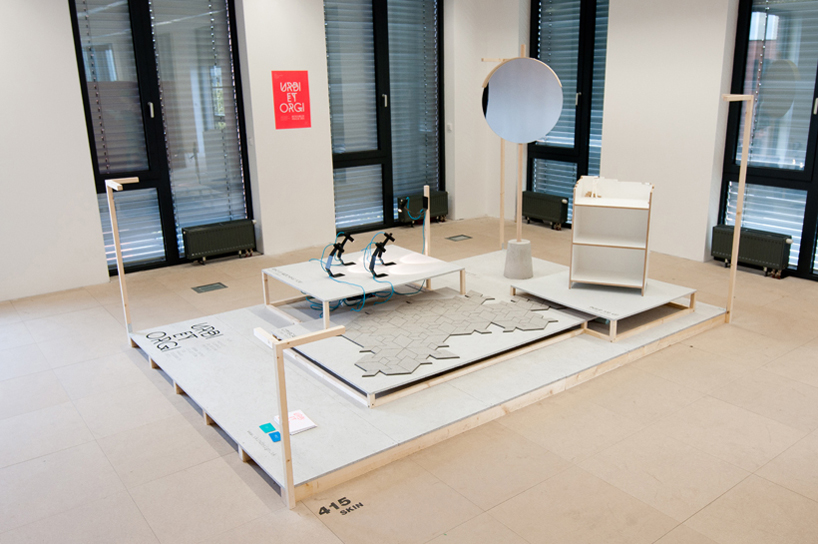
I want to click on shelves, so click(600, 276), click(609, 240), click(614, 203).